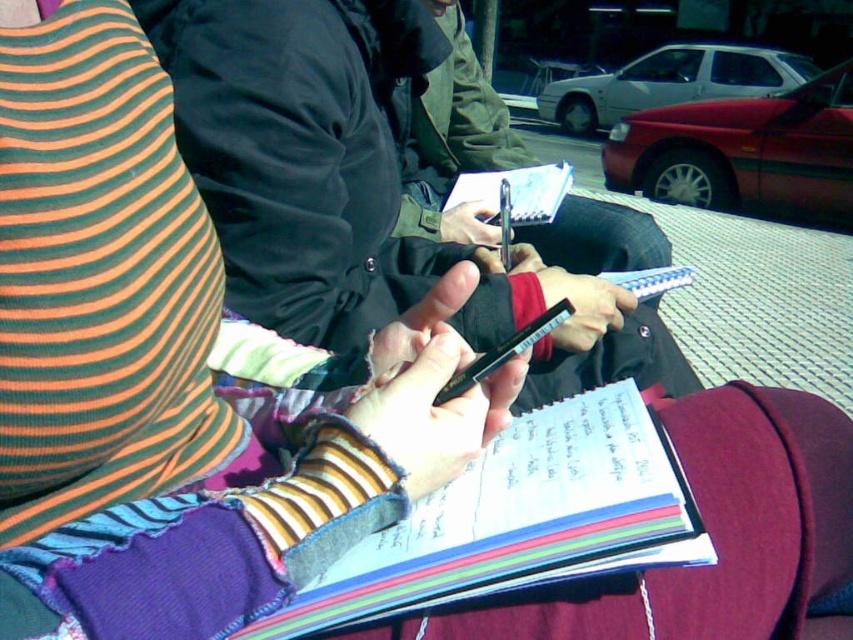
Question: Which of the following is the closest to the observer?

Choices:
 (A) white paper at center
 (B) green fabric jacket at center
 (C) multicolored paper notebook at center

Answer: (C)

Question: Where is black matte jacket at center located in relation to green fabric jacket at center in the image?

Choices:
 (A) below
 (B) above

Answer: (A)

Question: Can you confirm if multicolored paper notebook at center is positioned above green fabric jacket at center?

Choices:
 (A) no
 (B) yes

Answer: (A)

Question: Does black matte jacket at center have a greater width compared to multicolored paper notebook at center?

Choices:
 (A) yes
 (B) no

Answer: (A)

Question: Which object is closer to the camera taking this photo?

Choices:
 (A) white paper at center
 (B) green fabric jacket at center

Answer: (B)

Question: Which point is farther from the camera taking this photo?

Choices:
 (A) (532, 461)
 (B) (509, 204)
 (C) (527, 332)
 (D) (410, 211)

Answer: (D)